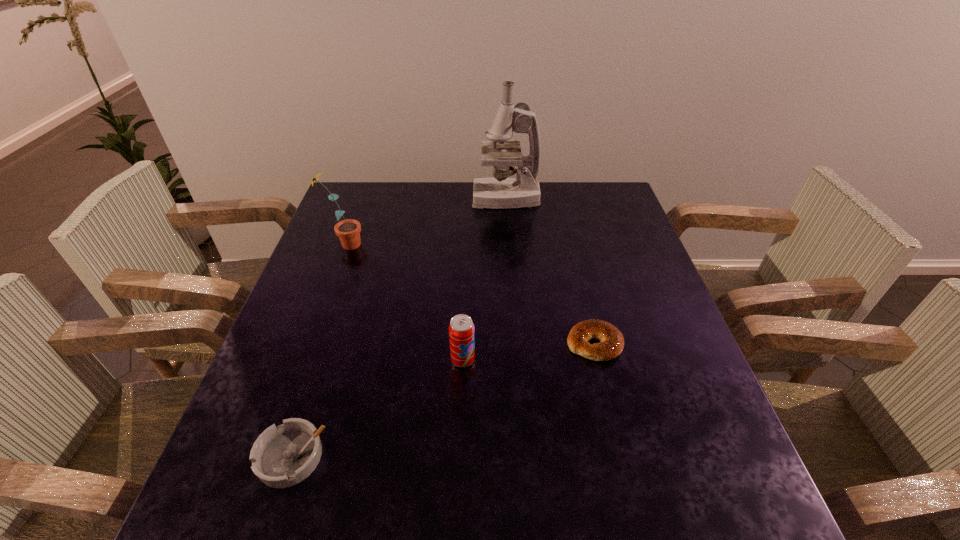
Find the location of a particular element. vacant space situated on the right of the ashtray is located at coordinates (423, 457).

Identify the location of free space located 0.150m on the back of the bagel. The image size is (960, 540). (579, 282).

At what (x,y) coordinates should I click in order to perform the action: click on object that is positioned at the far edge. Please return your answer as a coordinate pair (x, y). Image resolution: width=960 pixels, height=540 pixels. Looking at the image, I should click on (500, 192).

This screenshot has width=960, height=540. Identify the location of object that is at the near edge. point(283,456).

The image size is (960, 540). Find the location of `sunflower that is at the left edge`. sunflower that is at the left edge is located at coordinates (348, 231).

This screenshot has width=960, height=540. I want to click on ashtray positioned at the left edge, so click(x=283, y=456).

Where is `object that is at the right edge`? The height and width of the screenshot is (540, 960). object that is at the right edge is located at coordinates (611, 344).

At what (x,y) coordinates should I click in order to perform the action: click on object at the near left corner. Please return your answer as a coordinate pair (x, y). The height and width of the screenshot is (540, 960). Looking at the image, I should click on (283, 456).

At what (x,y) coordinates should I click in order to perform the action: click on free space at the far edge. Please return your answer as a coordinate pair (x, y). Looking at the image, I should click on (398, 191).

The width and height of the screenshot is (960, 540). In order to click on vacant area at the left edge in this screenshot , I will do `click(345, 265)`.